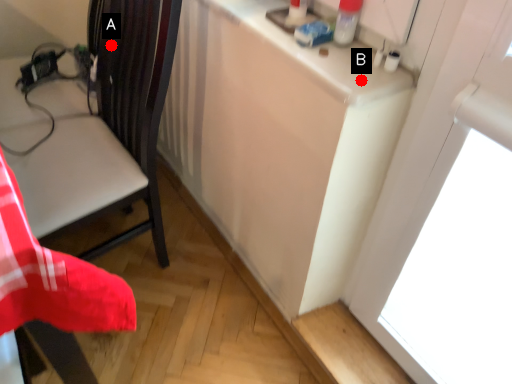
Question: Two points are circled on the image, labeled by A and B beside each circle. Which point is further to the camera?

Choices:
 (A) A is further
 (B) B is further

Answer: (A)